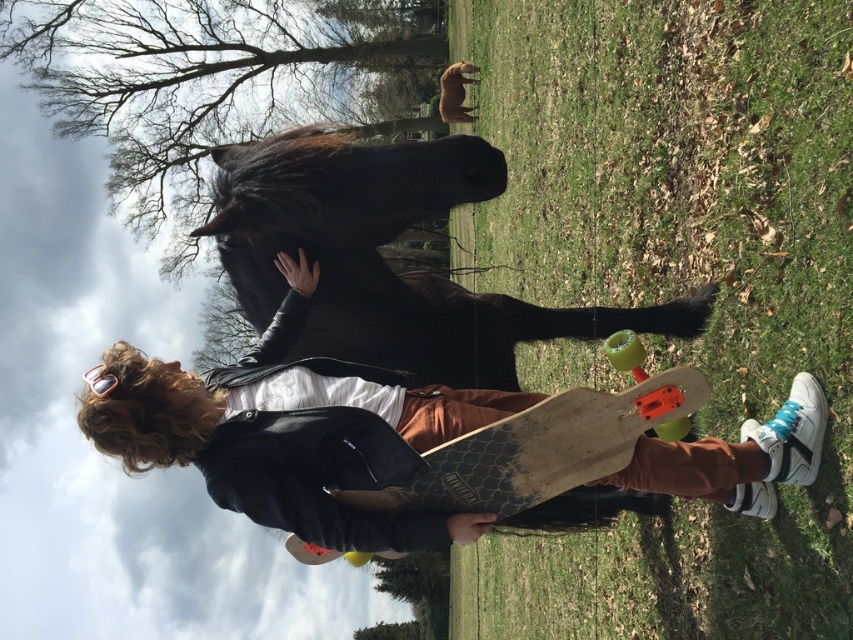
Does black glossy horse at center come in front of wooden skateboard at center?

No, it is behind wooden skateboard at center.

Is black glossy horse at center positioned behind wooden skateboard at center?

Yes.

Which is in front, point (419, 216) or point (207, 476)?

Point (207, 476)

Where is `black glossy horse at center`? The height and width of the screenshot is (640, 853). black glossy horse at center is located at coordinates (386, 260).

Which of these two, wooden skateboard at center or wooden textured skateboard at center, stands taller?

wooden skateboard at center is taller.

What do you see at coordinates (262, 394) in the screenshot?
I see `wooden skateboard at center` at bounding box center [262, 394].

This screenshot has width=853, height=640. In order to click on wooden skateboard at center in this screenshot , I will do `click(262, 394)`.

Measure the distance between black glossy horse at center and wooden textured skateboard at center.

black glossy horse at center and wooden textured skateboard at center are 36.25 inches apart from each other.

Who is positioned more to the right, black glossy horse at center or wooden textured skateboard at center?

From the viewer's perspective, wooden textured skateboard at center appears more on the right side.

Does point (252, 282) come in front of point (602, 429)?

No.

Where is `black glossy horse at center`? black glossy horse at center is located at coordinates (386, 260).